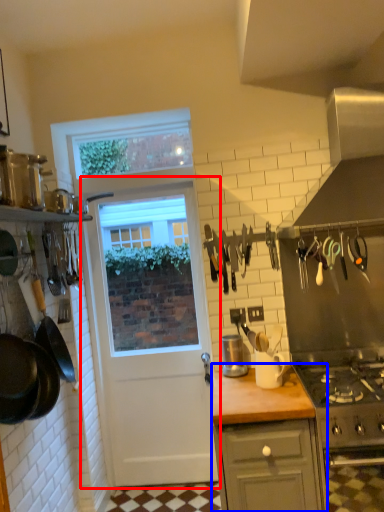
Question: Which object is further to the camera taking this photo, door (highlighted by a red box) or cabinetry (highlighted by a blue box)?

Choices:
 (A) door
 (B) cabinetry

Answer: (A)